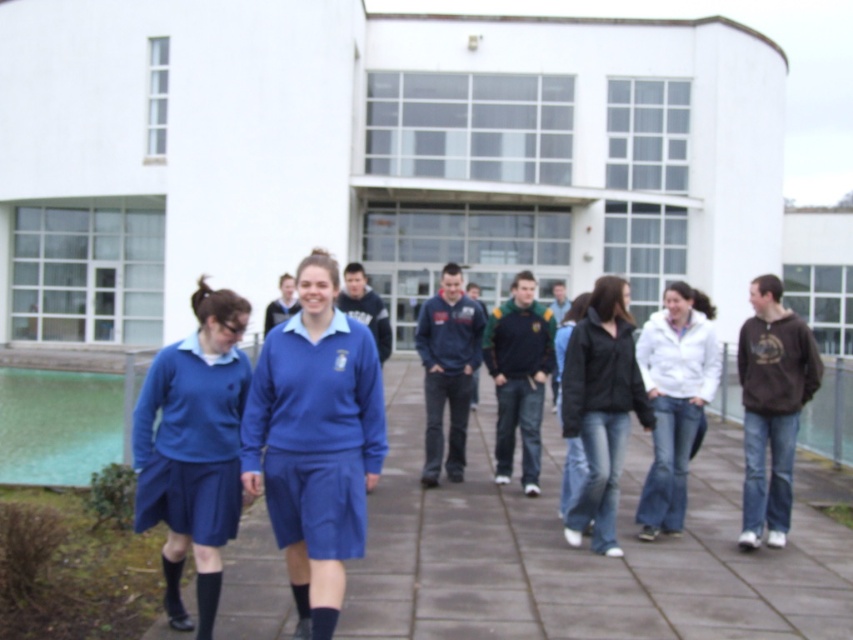
Question: Is green and yellow jersey at center wider than brown cotton sweatshirt at right?

Choices:
 (A) no
 (B) yes

Answer: (B)

Question: Among these points, which one is farthest from the camera?

Choices:
 (A) (589, 314)
 (B) (328, 433)
 (C) (480, 326)
 (D) (618, 378)

Answer: (C)

Question: Which is nearer to the matte blue skirt at center?

Choices:
 (A) navy blue fleece at center
 (B) green and yellow jersey at center
 (C) white matte jacket at center

Answer: (C)

Question: Can you confirm if white matte jacket at center is thinner than navy blue fleece at center?

Choices:
 (A) yes
 (B) no

Answer: (A)

Question: Is matte blue uniform at center above matte blue skirt at center?

Choices:
 (A) no
 (B) yes

Answer: (B)

Question: Which object is closer to the camera taking this photo?

Choices:
 (A) brown cotton hoodie at right
 (B) black matte sweatshirt at center
 (C) matte blue uniform at center
 (D) brown cotton sweatshirt at right

Answer: (C)